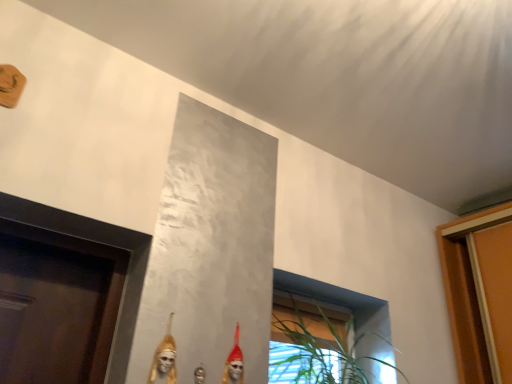
Locate an element on the screen. The image size is (512, 384). matte red plastic mask at lower center is located at coordinates (234, 363).

The width and height of the screenshot is (512, 384). What do you see at coordinates (234, 363) in the screenshot? I see `matte red plastic mask at lower center` at bounding box center [234, 363].

Find the location of a particular element. The width and height of the screenshot is (512, 384). matte red plastic mask at lower center is located at coordinates (234, 363).